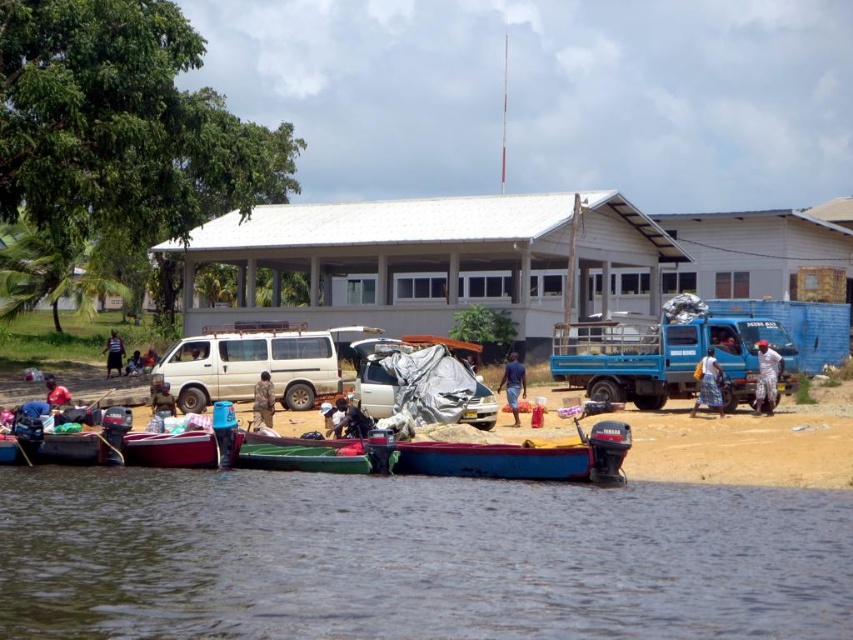
You are planning to store a large camping tent. You see the wooden canoe at center and the dark blue fabric at center. Which object has enough space to accommodate the tent?

The wooden canoe at center has a larger size compared to dark blue fabric at center, so it can accommodate the tent.